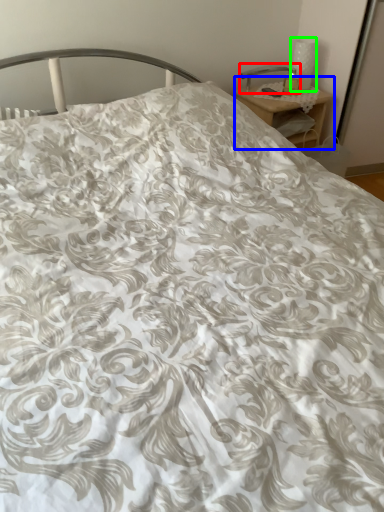
Question: Which is nearer to the table lamp (highlighted by a red box)? nightstand (highlighted by a blue box) or table lamp (highlighted by a green box).

Choices:
 (A) nightstand
 (B) table lamp

Answer: (B)